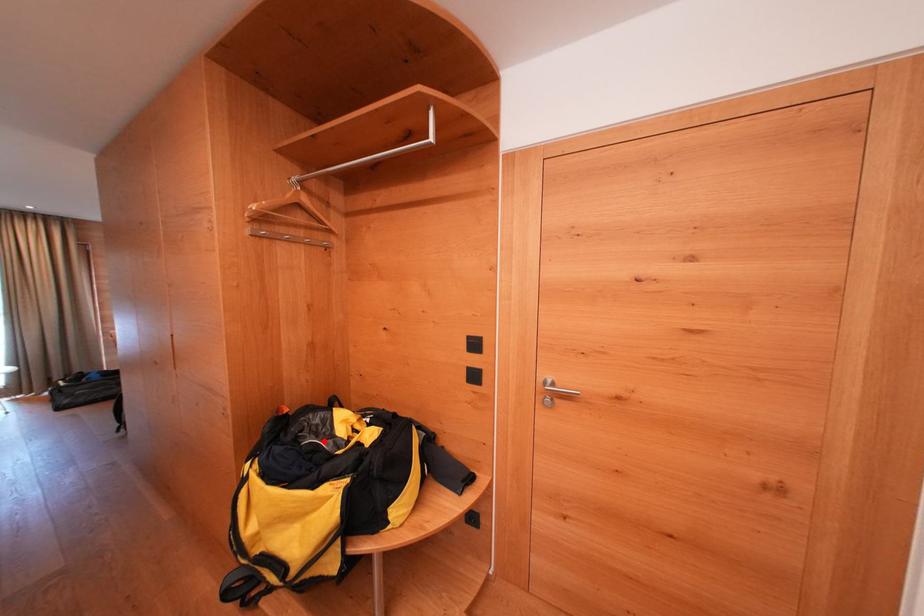
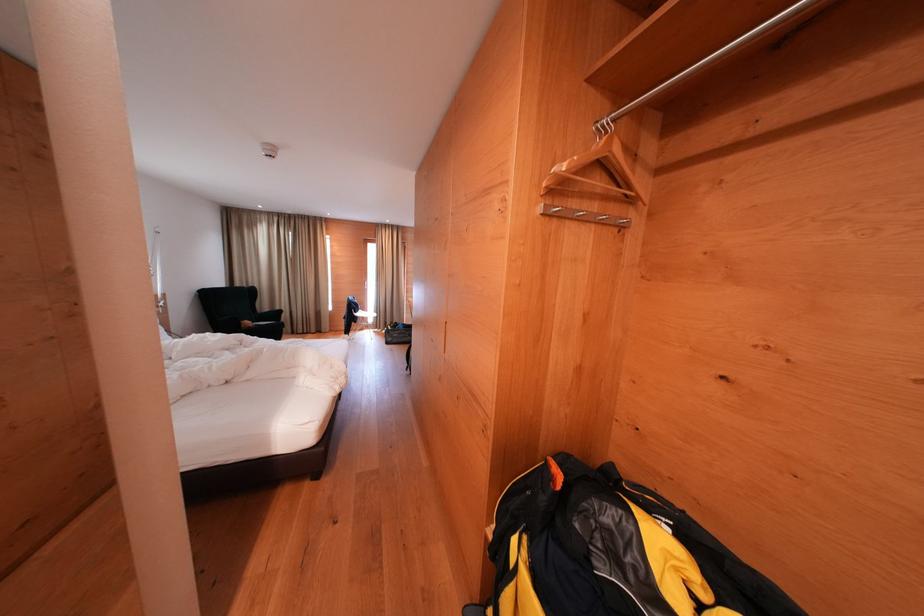
In the second image, find the point that corresponds to the highlighted location in the first image.

(635, 584)